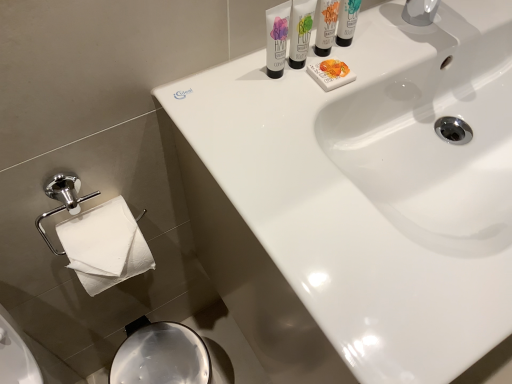
Locate an element on the screen. The height and width of the screenshot is (384, 512). vacant point to the right of matte white shaving cream at upper center, the second shaving cream in the right-to-left sequence is located at coordinates (389, 49).